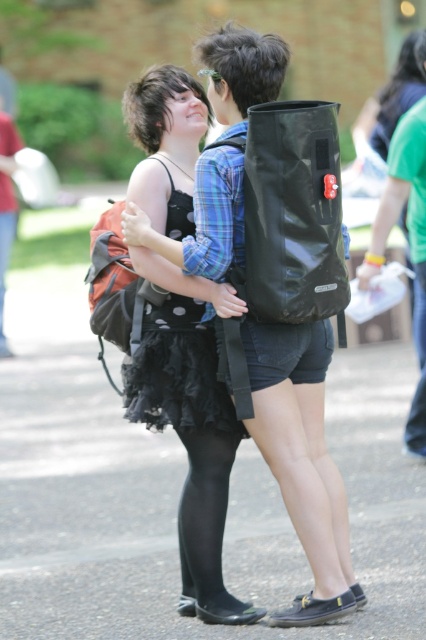
Question: Among these objects, which one is nearest to the camera?

Choices:
 (A) black tulle skirt at center
 (B) green fabric shirt at upper right
 (C) denim shorts at lower right

Answer: (A)

Question: Is black tulle skirt at center closer to the viewer compared to black polka dot dress at center?

Choices:
 (A) no
 (B) yes

Answer: (B)

Question: Where is black tulle skirt at center located in relation to denim shorts at lower right in the image?

Choices:
 (A) left
 (B) right

Answer: (A)

Question: Which is nearer to the black polka dot dress at center?

Choices:
 (A) green fabric shirt at upper right
 (B) denim shorts at lower right
 (C) black matte backpack at center

Answer: (C)

Question: Among these points, which one is nearest to the camera?

Choices:
 (A) 201,372
 (B) 150,381
 (C) 374,266

Answer: (B)

Question: Does black tulle skirt at center appear on the left side of green fabric shirt at upper right?

Choices:
 (A) yes
 (B) no

Answer: (A)